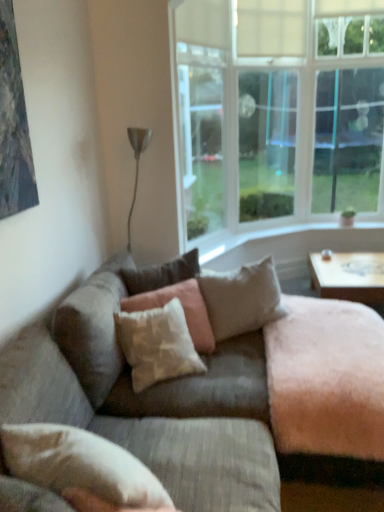
Question: Should I look upward or downward to see textured beige couch at center?

Choices:
 (A) down
 (B) up

Answer: (A)

Question: Is transparent glass window at center, the 2th window screen when ordered from left to right, at the left side of transparent plastic window screen at upper center, which ranks as the 1th window screen in left-to-right order?

Choices:
 (A) yes
 (B) no

Answer: (B)

Question: Is transparent glass window at center, which is counted as the 2th window screen, starting from the right, behind transparent plastic window screen at upper center, positioned as the 3th window screen in right-to-left order?

Choices:
 (A) no
 (B) yes

Answer: (B)

Question: Is transparent glass window at center, the 2th window screen when ordered from left to right, oriented towards transparent plastic window screen at upper center, which ranks as the 1th window screen in left-to-right order?

Choices:
 (A) no
 (B) yes

Answer: (A)

Question: From a real-world perspective, does transparent glass window at center, the 2th window screen when ordered from left to right, stand above transparent plastic window screen at upper center, which ranks as the 1th window screen in left-to-right order?

Choices:
 (A) yes
 (B) no

Answer: (A)

Question: Is transparent glass window at center, which is counted as the 2th window screen, starting from the right, to the right of transparent plastic window screen at upper center, which ranks as the 1th window screen in left-to-right order, from the viewer's perspective?

Choices:
 (A) no
 (B) yes

Answer: (B)

Question: Does transparent glass window at center, which is counted as the 2th window screen, starting from the right, contain transparent plastic window screen at upper center, which ranks as the 1th window screen in left-to-right order?

Choices:
 (A) no
 (B) yes

Answer: (A)

Question: Does transparent plastic window screen at upper center, positioned as the 3th window screen in right-to-left order, have a lesser height compared to clear glass window at upper right, marked as the first window screen in a right-to-left arrangement?

Choices:
 (A) no
 (B) yes

Answer: (B)

Question: Can clear glass window at upper right, which is the third window screen from left to right, be found inside transparent plastic window screen at upper center, positioned as the 3th window screen in right-to-left order?

Choices:
 (A) yes
 (B) no

Answer: (B)

Question: Is transparent plastic window screen at upper center, positioned as the 3th window screen in right-to-left order, to the right of clear glass window at upper right, which is the third window screen from left to right, from the viewer's perspective?

Choices:
 (A) yes
 (B) no

Answer: (B)

Question: Does transparent plastic window screen at upper center, positioned as the 3th window screen in right-to-left order, have a smaller size compared to clear glass window at upper right, marked as the first window screen in a right-to-left arrangement?

Choices:
 (A) yes
 (B) no

Answer: (B)

Question: From the image's perspective, is transparent plastic window screen at upper center, which ranks as the 1th window screen in left-to-right order, below clear glass window at upper right, which is the third window screen from left to right?

Choices:
 (A) yes
 (B) no

Answer: (A)

Question: Is transparent plastic window screen at upper center, positioned as the 3th window screen in right-to-left order, aimed at clear glass window at upper right, which is the third window screen from left to right?

Choices:
 (A) yes
 (B) no

Answer: (B)

Question: Can you confirm if white fabric pillow at lower left, the fourth pillow in the back-to-front sequence, is smaller than light beige fabric pillow at center, marked as the 3th pillow in a front-to-back arrangement?

Choices:
 (A) yes
 (B) no

Answer: (A)